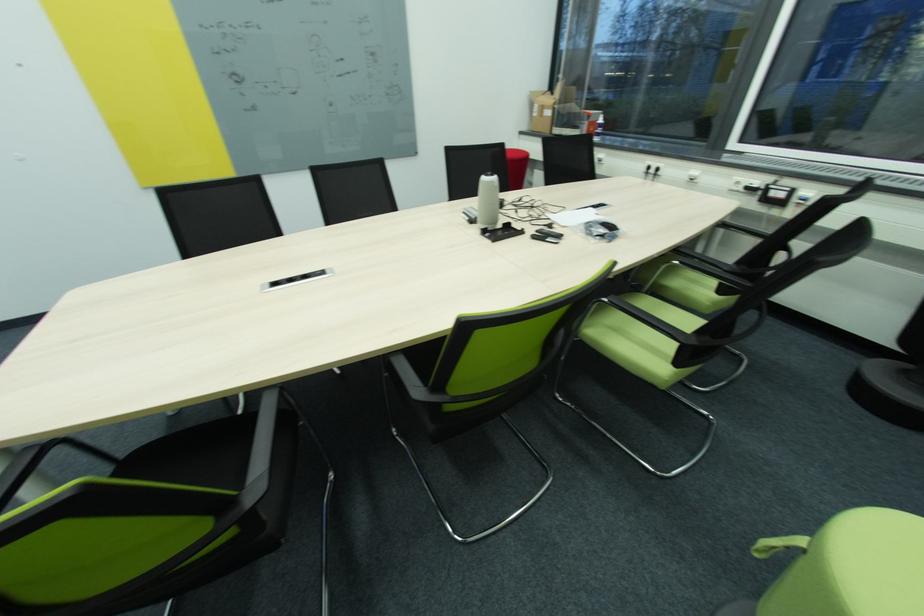
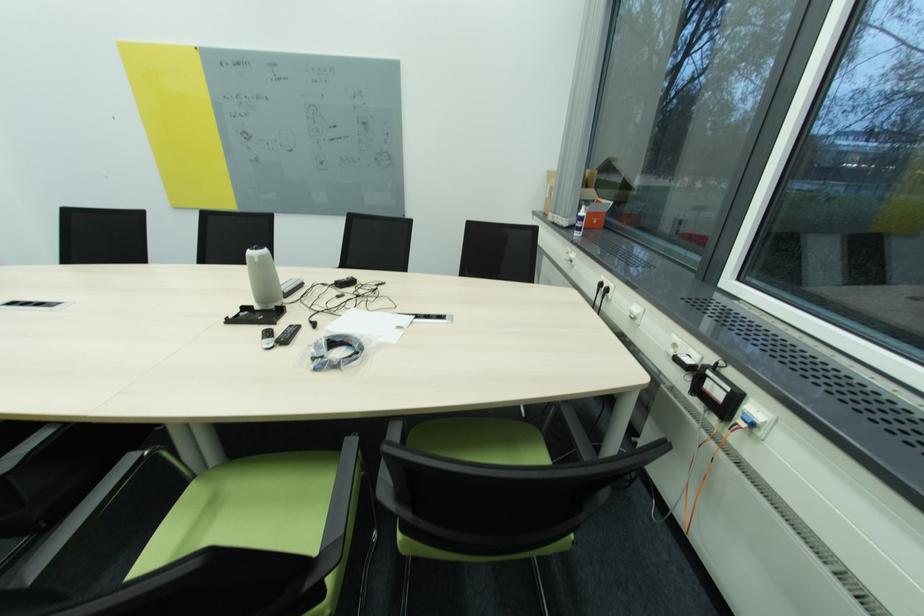
Find the pixel in the second image that matches pixel 776 188 in the first image.

(713, 373)